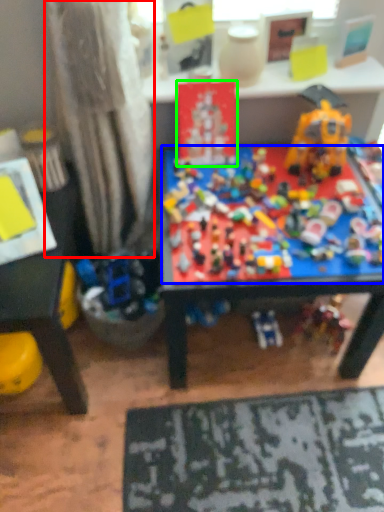
Question: Which object is the closest to the curtain (highlighted by a red box)? Choose among these: toy (highlighted by a blue box) or toy (highlighted by a green box).

Choices:
 (A) toy
 (B) toy

Answer: (B)